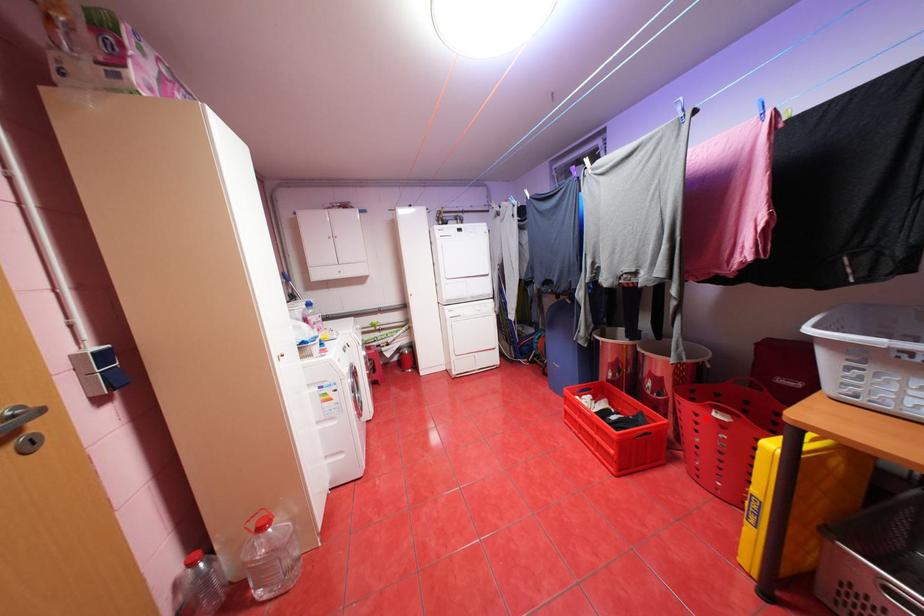
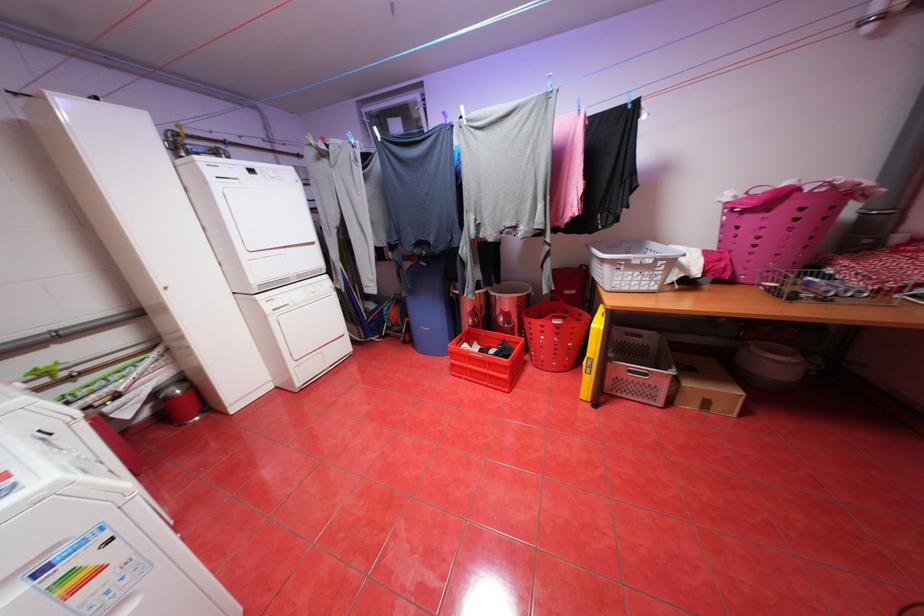
The point at the highlighted location is marked in the first image. Where is the corresponding point in the second image?

(552, 329)